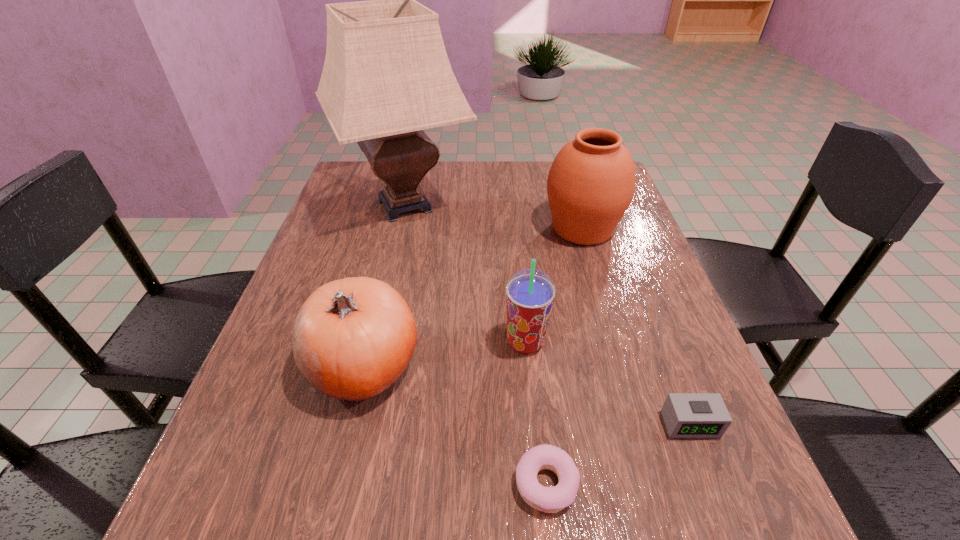
At what (x,y) coordinates should I click in order to perform the action: click on vacant region between the pumpkin and the second shortest object. Please return your answer as a coordinate pair (x, y). Looking at the image, I should click on (526, 394).

Identify which object is the nearest to the fifth tallest object. Please provide its 2D coordinates. Your answer should be formatted as a tuple, i.e. [(x, y)], where the tuple contains the x and y coordinates of a point satisfying the conditions above.

[(546, 499)]

Point out which object is positioned as the nearest to the nearest object. Please provide its 2D coordinates. Your answer should be formatted as a tuple, i.e. [(x, y)], where the tuple contains the x and y coordinates of a point satisfying the conditions above.

[(686, 415)]

The width and height of the screenshot is (960, 540). What are the coordinates of `blank space that satisfies the following two spatial constraints: 1. on the back side of the tallest object; 2. on the right side of the pumpkin` in the screenshot? It's located at tap(401, 206).